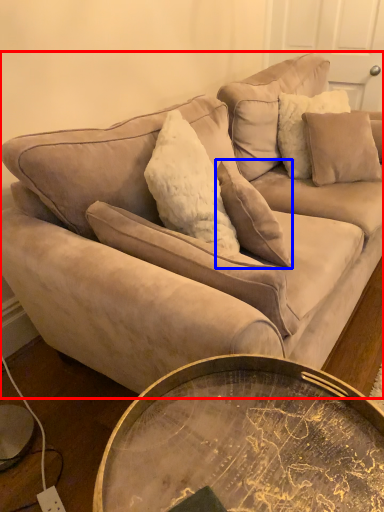
Question: Which object is closer to the camera taking this photo, studio couch (highlighted by a red box) or pillow (highlighted by a blue box)?

Choices:
 (A) studio couch
 (B) pillow

Answer: (A)